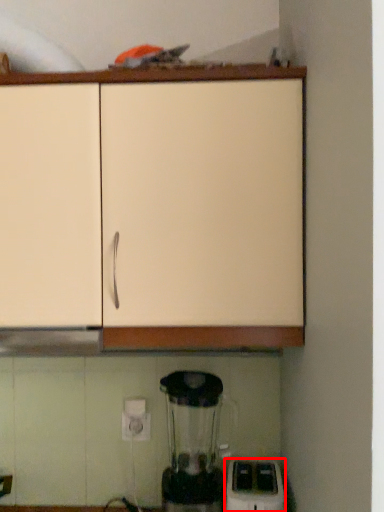
Question: From the image's perspective, considering the relative positions of home appliance (annotated by the red box) and cabinetry in the image provided, where is home appliance (annotated by the red box) located with respect to the staircase?

Choices:
 (A) below
 (B) above

Answer: (A)